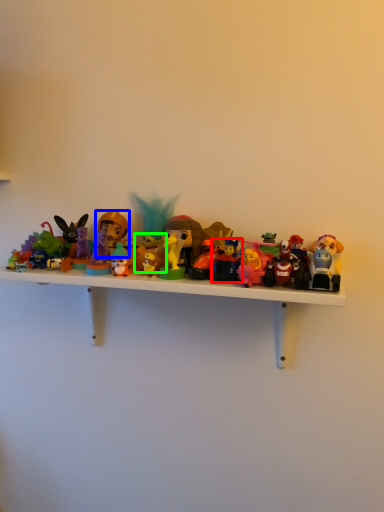
Question: Estimate the real-world distances between objects in this image. Which object is farther from toy (highlighted by a red box), toy (highlighted by a blue box) or toy (highlighted by a green box)?

Choices:
 (A) toy
 (B) toy

Answer: (A)